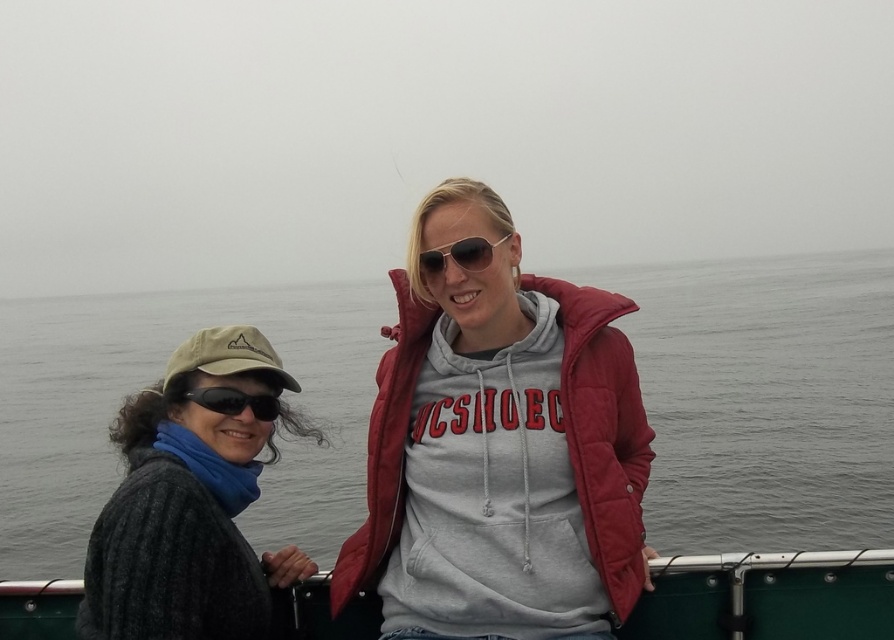
The image size is (894, 640). What do you see at coordinates (500, 448) in the screenshot? I see `matte gray hoodie at center` at bounding box center [500, 448].

Between point (549, 637) and point (243, 552), which one is positioned behind?

Point (243, 552)

Where is `matte gray hoodie at center`? matte gray hoodie at center is located at coordinates [500, 448].

Can you confirm if dark gray knit sweater at left is positioned to the right of matte black sunglasses at center?

No, dark gray knit sweater at left is not to the right of matte black sunglasses at center.

Does dark gray knit sweater at left have a lesser width compared to matte black sunglasses at center?

No, dark gray knit sweater at left is not thinner than matte black sunglasses at center.

Locate an element on the screen. dark gray knit sweater at left is located at coordinates (170, 561).

Who is more distant from viewer, (x=525, y=557) or (x=234, y=387)?

Positioned behind is point (x=234, y=387).

Does matte gray hoodie at center lie in front of black matte sunglasses at left?

That is True.

This screenshot has height=640, width=894. Find the location of `matte gray hoodie at center`. matte gray hoodie at center is located at coordinates (500, 448).

Identify the location of matte gray hoodie at center. (x=500, y=448).